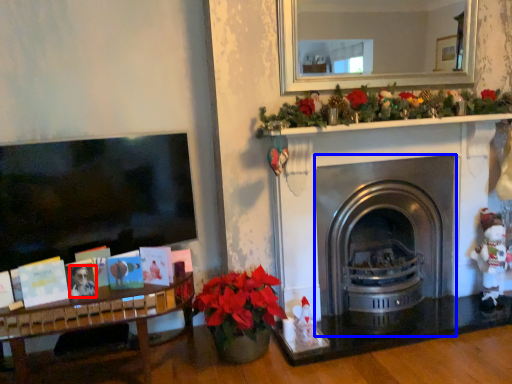
Question: Which point is further to the camera, person (highlighted by a red box) or fireplace (highlighted by a blue box)?

Choices:
 (A) person
 (B) fireplace

Answer: (B)